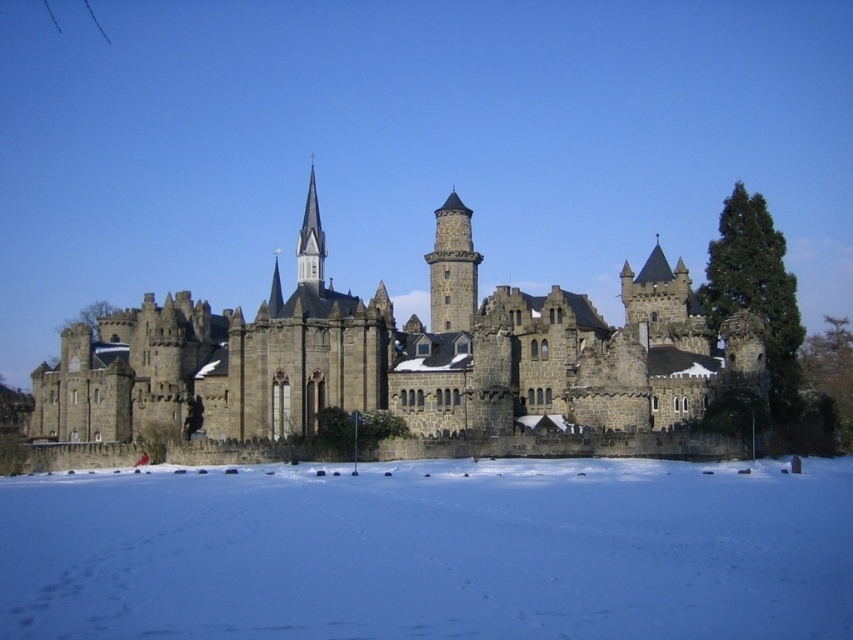
Question: Is white powdery snow at lower center to the left of dark gray stone tower at center from the viewer's perspective?

Choices:
 (A) yes
 (B) no

Answer: (A)

Question: Does white powdery snow at lower center appear on the left side of dark gray stone tower at center?

Choices:
 (A) no
 (B) yes

Answer: (B)

Question: Which is farther from the white powdery snow at lower center?

Choices:
 (A) dark stone castle at center
 (B) smooth gray steeple at center

Answer: (B)

Question: Does white powdery snow at lower center lie in front of dark stone castle at center?

Choices:
 (A) no
 (B) yes

Answer: (B)

Question: Which object is the farthest from the smooth gray steeple at center?

Choices:
 (A) dark stone castle at center
 (B) dark gray stone tower at center

Answer: (A)

Question: Which point is farther to the camera?

Choices:
 (A) click(x=461, y=285)
 (B) click(x=767, y=618)

Answer: (A)